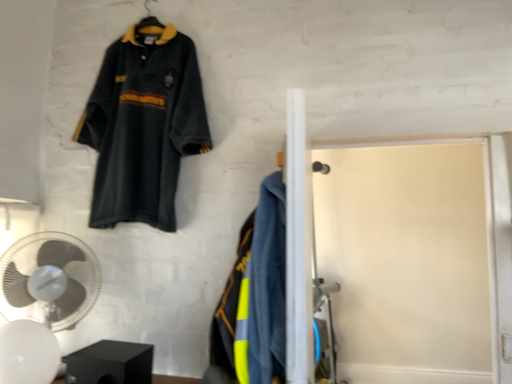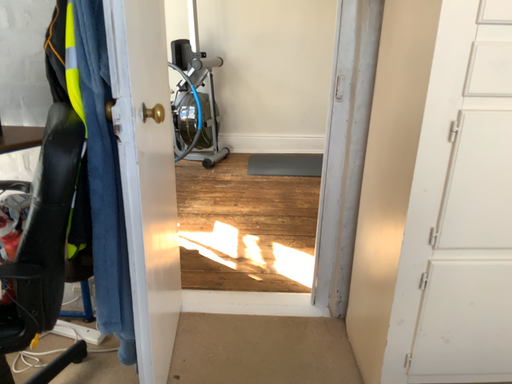
Question: How did the camera likely rotate when shooting the video?

Choices:
 (A) rotated downward
 (B) rotated upward

Answer: (A)